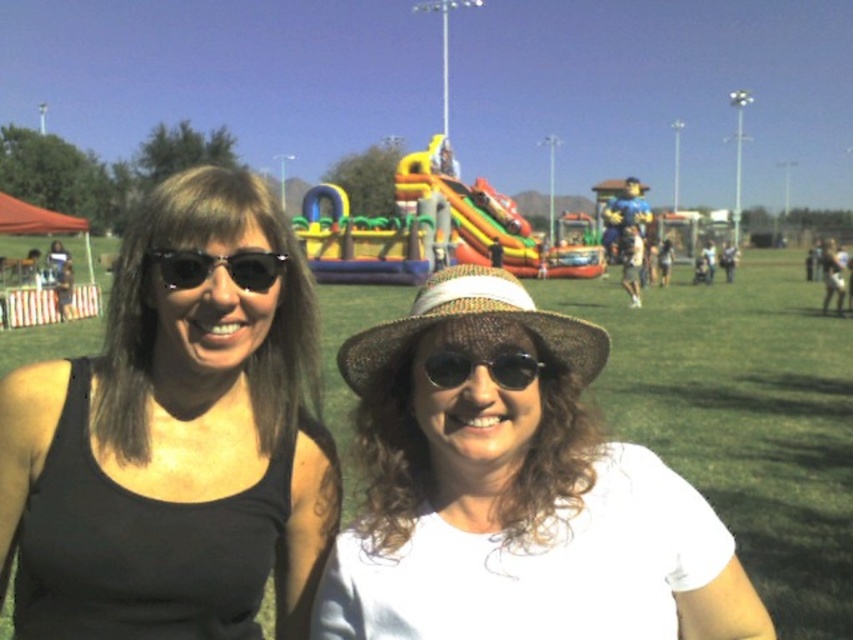
Question: Which object is the closest to the black reflective sunglasses at left?

Choices:
 (A) black reflective sunglasses at center
 (B) black matte tank top at center
 (C) white woven hat at center

Answer: (B)

Question: Which of the following is the closest to the observer?

Choices:
 (A) (200, 252)
 (B) (525, 355)
 (C) (583, 369)

Answer: (A)

Question: Can you confirm if black matte tank top at center is thinner than white woven hat at center?

Choices:
 (A) no
 (B) yes

Answer: (B)

Question: Is white woven hat at center closer to the viewer compared to brown woven hat at center?

Choices:
 (A) yes
 (B) no

Answer: (A)

Question: Does brown woven hat at center have a smaller size compared to black reflective sunglasses at left?

Choices:
 (A) no
 (B) yes

Answer: (A)

Question: Which object is farther from the camera taking this photo?

Choices:
 (A) black matte tank top at center
 (B) black reflective sunglasses at left

Answer: (B)